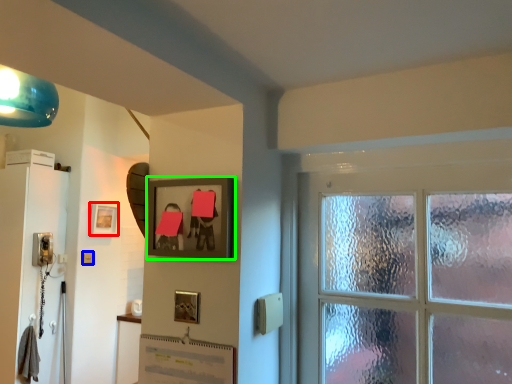
Question: Which is farther away from picture frame (highlighted by a red box)? light switch (highlighted by a blue box) or picture frame (highlighted by a green box)?

Choices:
 (A) light switch
 (B) picture frame

Answer: (B)